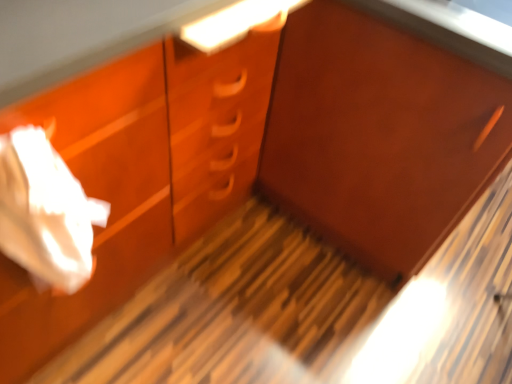
What do you see at coordinates (98, 198) in the screenshot?
I see `white paper at left` at bounding box center [98, 198].

Measure the distance between white paper at left and camera.

white paper at left is 24.27 inches away from camera.

Locate an element on the screen. The image size is (512, 384). white paper at left is located at coordinates (98, 198).

The image size is (512, 384). Describe the element at coordinates (379, 136) in the screenshot. I see `matte wood cabinet at center` at that location.

Identify the location of matte wood cabinet at center. (379, 136).

You are a GUI agent. You are given a task and a screenshot of the screen. Output one action in this format:
    pyautogui.click(x=<x>, y=<y>)
    Task: Click on the white paper at left
    This screenshot has width=512, height=384.
    Given the screenshot: What is the action you would take?
    pyautogui.click(x=98, y=198)

Between white paper at left and matte wood cabinet at center, which one appears on the right side from the viewer's perspective?

Answer: Positioned to the right is matte wood cabinet at center.

Which is in front, white paper at left or matte wood cabinet at center?

white paper at left is more forward.

Is point (20, 299) less distant than point (256, 186)?

Yes.

From the image's perspective, is white paper at left positioned above or below matte wood cabinet at center?

white paper at left is situated lower than matte wood cabinet at center in the image.

From a real-world perspective, between white paper at left and matte wood cabinet at center, who is vertically higher?

In real-world perspective, white paper at left is above.

Can you confirm if white paper at left is thinner than matte wood cabinet at center?

Yes, white paper at left is thinner than matte wood cabinet at center.

Who is taller, white paper at left or matte wood cabinet at center?

matte wood cabinet at center.

Considering the relative sizes of white paper at left and matte wood cabinet at center in the image provided, is white paper at left bigger than matte wood cabinet at center?

No.

Is white paper at left spatially inside matte wood cabinet at center, or outside of it?

white paper at left lies outside matte wood cabinet at center.

Is white paper at left next to matte wood cabinet at center?

There is a gap between white paper at left and matte wood cabinet at center.

Does white paper at left turn towards matte wood cabinet at center?

No.

Locate an element on the screen. Image resolution: width=512 pixels, height=384 pixels. cabinetry below the white paper at left (from a real-world perspective) is located at coordinates (379, 136).

Which object is positioned more to the left, matte wood cabinet at center or white paper at left?

From the viewer's perspective, white paper at left appears more on the left side.

Which object is closer to the camera taking this photo, matte wood cabinet at center or white paper at left?

Positioned in front is white paper at left.

Considering the positions of points (382, 186) and (140, 241), is point (382, 186) farther from camera compared to point (140, 241)?

Yes, it is behind point (140, 241).

From the image's perspective, relative to white paper at left, is matte wood cabinet at center above or below?

From the image's perspective, matte wood cabinet at center appears above white paper at left.

From a real-world perspective, does matte wood cabinet at center stand above white paper at left?

No, from a real-world perspective, matte wood cabinet at center is not above white paper at left.

Can you confirm if matte wood cabinet at center is wider than white paper at left?

Yes.

Does matte wood cabinet at center have a lesser height compared to white paper at left?

In fact, matte wood cabinet at center may be taller than white paper at left.

Considering the relative sizes of matte wood cabinet at center and white paper at left in the image provided, is matte wood cabinet at center smaller than white paper at left?

Actually, matte wood cabinet at center might be larger than white paper at left.

Choose the correct answer: Is matte wood cabinet at center inside white paper at left or outside it?

matte wood cabinet at center is not inside white paper at left, it's outside.

Does matte wood cabinet at center touch white paper at left?

No, matte wood cabinet at center is not beside white paper at left.

Does matte wood cabinet at center turn towards white paper at left?

Yes, matte wood cabinet at center is oriented towards white paper at left.

Consider the image. Can you tell me how much matte wood cabinet at center and white paper at left differ in facing direction?

matte wood cabinet at center and white paper at left are facing 99.6 degrees away from each other.

What are the coordinates of `cabinetry directly beneath the white paper at left (from a real-world perspective)` in the screenshot? It's located at (379, 136).

The height and width of the screenshot is (384, 512). I want to click on drawer lying below the matte wood cabinet at center (from the image's perspective), so pyautogui.click(x=98, y=198).

Image resolution: width=512 pixels, height=384 pixels. Find the location of `drawer that is on the left side of matte wood cabinet at center`. drawer that is on the left side of matte wood cabinet at center is located at coordinates (98, 198).